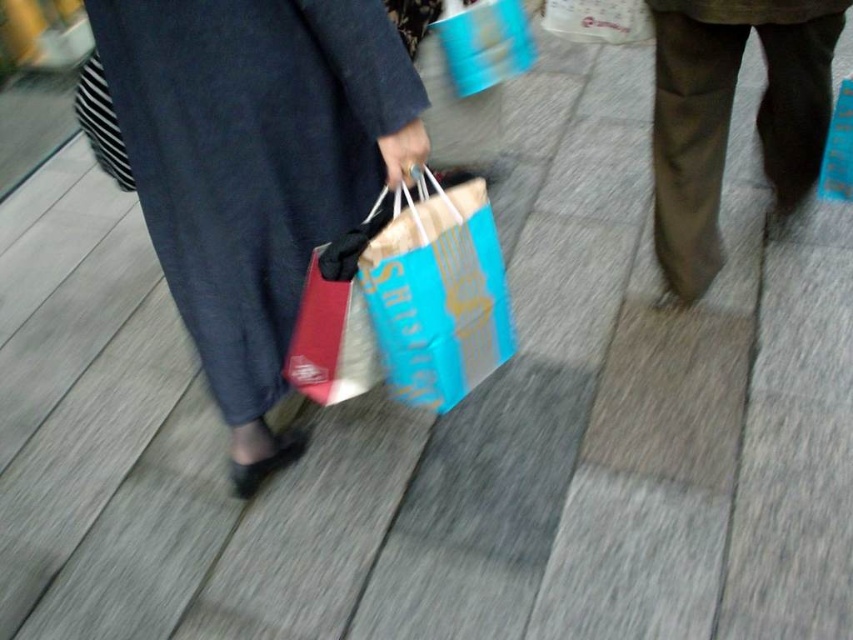
You are standing on a wooden deck and see the dark brown pants at right and the blue paper bag at center. Which object is located to the right of the other?

The dark brown pants at right is positioned on the right side of blue paper bag at center.

You are a fashion designer observing the scene. You need to determine which clothing item is wider between the matte fabric dress at center and the dark brown pants at right. Which one is wider?

The matte fabric dress at center is wider than the dark brown pants at right according to the description provided.

Consider the image. You are a photographer trying to capture a closeup of the matte fabric dress at center. The camera can focus on objects within 40 inches. Can you take the photo without moving closer?

The matte fabric dress at center is 39.01 inches from camera, so yes, the camera can focus on it since it is within the 40 inches range.